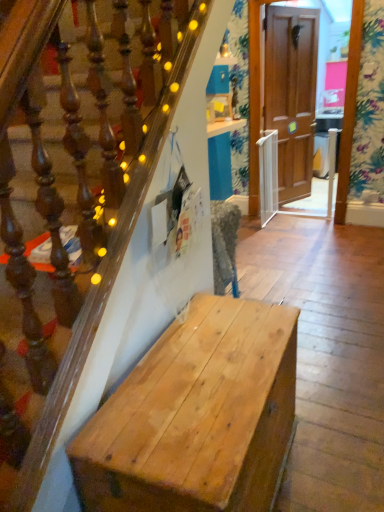
Question: In terms of height, does natural wood bench at lower left look taller or shorter compared to wooden door at center?

Choices:
 (A) tall
 (B) short

Answer: (B)

Question: From the image's perspective, is natural wood bench at lower left above or below wooden door at center?

Choices:
 (A) above
 (B) below

Answer: (B)

Question: Visually, is natural wood bench at lower left positioned to the left or to the right of wooden door at center?

Choices:
 (A) right
 (B) left

Answer: (B)

Question: Is point (288, 32) closer or farther from the camera than point (160, 476)?

Choices:
 (A) closer
 (B) farther

Answer: (B)

Question: Looking at the image, does wooden door at center seem bigger or smaller compared to natural wood bench at lower left?

Choices:
 (A) small
 (B) big

Answer: (A)

Question: From a real-world perspective, is wooden door at center above or below natural wood bench at lower left?

Choices:
 (A) below
 (B) above

Answer: (B)

Question: In terms of height, does wooden door at center look taller or shorter compared to natural wood bench at lower left?

Choices:
 (A) short
 (B) tall

Answer: (B)